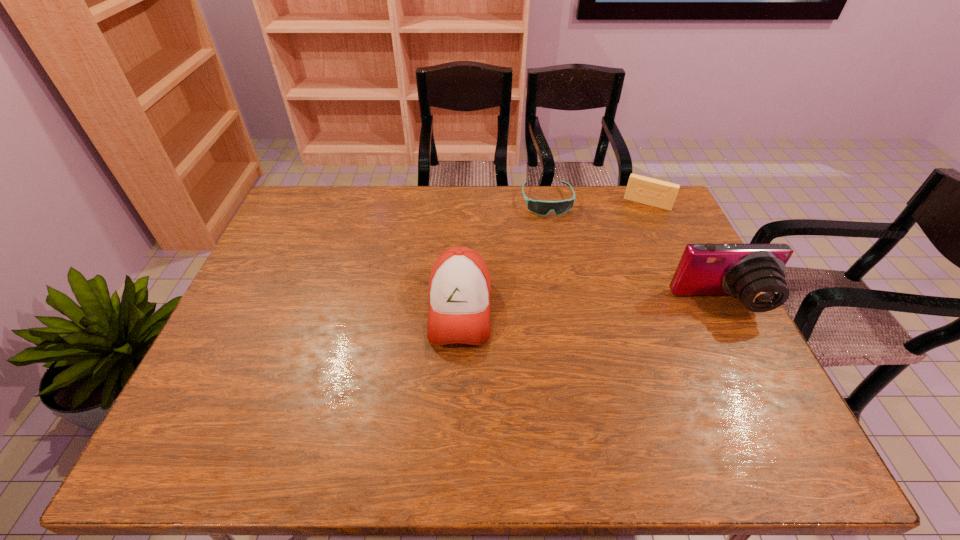
This screenshot has width=960, height=540. Identify the location of free spot on the desktop that is between the baseball cap and the camera and is positioned at the front of the videotape with spools. (608, 307).

Find the location of a particular element. The width and height of the screenshot is (960, 540). vacant space on the desktop that is between the baseball cap and the camera and is positioned on the front-facing side of the shortest object is located at coordinates (572, 307).